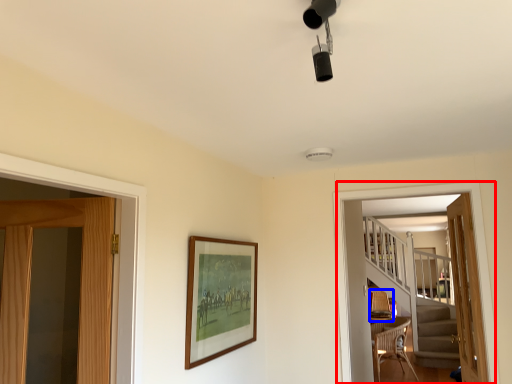
Question: Which of the following is the closest to the observer, screen door (highlighted by a red box) or armchair (highlighted by a blue box)?

Choices:
 (A) screen door
 (B) armchair

Answer: (A)